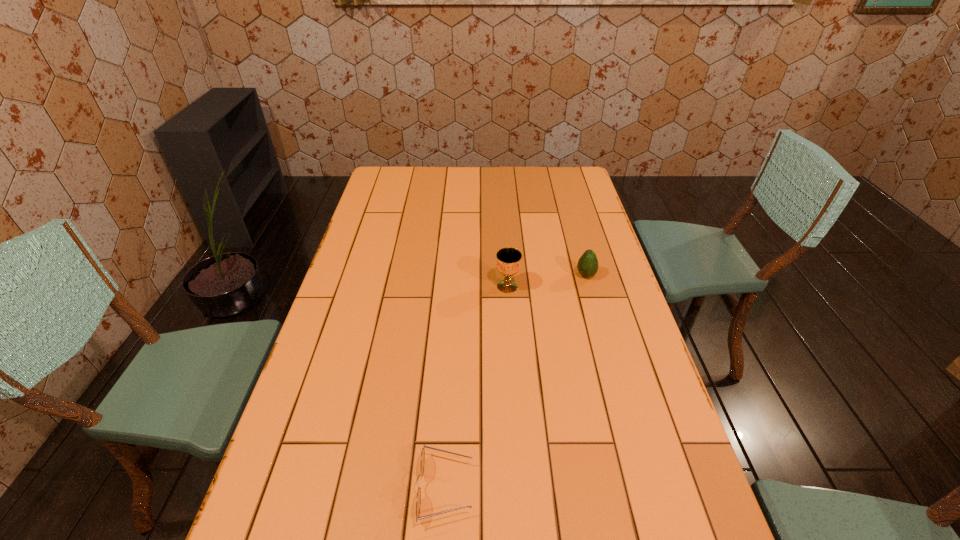
Identify the location of vacant space that's between the second object from left to right and the leftmost object. (476, 387).

At what (x,y) coordinates should I click in order to perform the action: click on vacant region between the rightmost object and the leftmost object. Please return your answer as a coordinate pair (x, y). Looking at the image, I should click on (516, 382).

Identify the location of empty location between the chalice and the nearest object. This screenshot has height=540, width=960. (476, 387).

The height and width of the screenshot is (540, 960). Identify the location of unoccupied position between the avocado and the tallest object. (546, 281).

Locate which object ranks in proximity to the chalice. Please provide its 2D coordinates. Your answer should be formatted as a tuple, i.e. [(x, y)], where the tuple contains the x and y coordinates of a point satisfying the conditions above.

[(587, 266)]

The width and height of the screenshot is (960, 540). What are the coordinates of `object that is the closest to the leftmost object` in the screenshot? It's located at (508, 259).

Where is `vacant area in the image that satisfies the following two spatial constraints: 1. on the back side of the avocado; 2. on the right side of the tallest object`? The height and width of the screenshot is (540, 960). vacant area in the image that satisfies the following two spatial constraints: 1. on the back side of the avocado; 2. on the right side of the tallest object is located at coordinates (507, 275).

You are a GUI agent. You are given a task and a screenshot of the screen. Output one action in this format:
    pyautogui.click(x=<x>, y=<y>)
    Task: Click on the vacant point that satisfies the following two spatial constraints: 1. on the front side of the avocado; 2. on the front-facing side of the shortest object
    
    Given the screenshot: What is the action you would take?
    pyautogui.click(x=644, y=488)

Find the location of `vacant space that satisfies the following two spatial constraints: 1. on the front side of the chalice; 2. on the front-facing side of the spectacles`. vacant space that satisfies the following two spatial constraints: 1. on the front side of the chalice; 2. on the front-facing side of the spectacles is located at coordinates (521, 488).

Where is `free location that satisfies the following two spatial constraints: 1. on the front side of the rightmost object; 2. on the front-facing side of the shortest object`? free location that satisfies the following two spatial constraints: 1. on the front side of the rightmost object; 2. on the front-facing side of the shortest object is located at coordinates (644, 488).